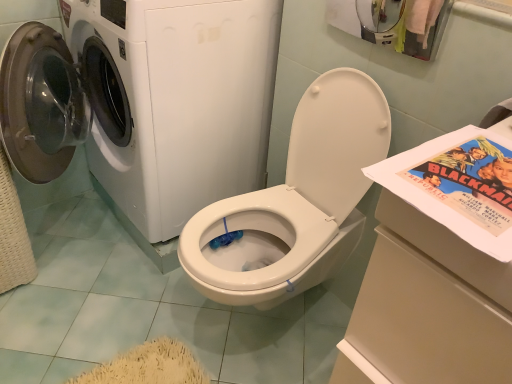
Describe the element at coordinates (297, 200) in the screenshot. The height and width of the screenshot is (384, 512). I see `white glossy washer at upper left` at that location.

The width and height of the screenshot is (512, 384). What do you see at coordinates (183, 103) in the screenshot? I see `white glossy washing machine at left` at bounding box center [183, 103].

Locate an element on the screen. white glossy washer at upper left is located at coordinates click(297, 200).

Considering the relative positions of matte paper comic book at right and white glossy washer at upper left in the image provided, is matte paper comic book at right to the right of white glossy washer at upper left from the viewer's perspective?

Yes, matte paper comic book at right is to the right of white glossy washer at upper left.

Does matte paper comic book at right have a lesser width compared to white glossy washer at upper left?

Yes, matte paper comic book at right is thinner than white glossy washer at upper left.

Considering the positions of objects matte paper comic book at right and white glossy washer at upper left in the image provided, who is behind, matte paper comic book at right or white glossy washer at upper left?

Positioned behind is white glossy washer at upper left.

Does matte paper comic book at right turn towards white glossy washer at upper left?

No, matte paper comic book at right is not turned towards white glossy washer at upper left.

From a real-world perspective, is white glossy washing machine at left above or below white glossy washer at upper left?

white glossy washing machine at left is situated higher than white glossy washer at upper left in the real world.

Does white glossy washing machine at left have a lesser height compared to white glossy washer at upper left?

No.

The width and height of the screenshot is (512, 384). I want to click on washer lying on the right of white glossy washing machine at left, so click(x=297, y=200).

Is the surface of white glossy washing machine at left in direct contact with white glossy washer at upper left?

No, white glossy washing machine at left is not in contact with white glossy washer at upper left.

From a real-world perspective, is matte paper comic book at right below white glossy washing machine at left?

Actually, matte paper comic book at right is physically above white glossy washing machine at left in the real world.

Can you confirm if matte paper comic book at right is taller than white glossy washing machine at left?

No, matte paper comic book at right is not taller than white glossy washing machine at left.

Considering the relative positions of matte paper comic book at right and white glossy washing machine at left in the image provided, is matte paper comic book at right in front of white glossy washing machine at left?

Yes, the depth of matte paper comic book at right is less than that of white glossy washing machine at left.

From the image's perspective, is matte paper comic book at right positioned above or below white glossy washing machine at left?

Clearly, from the image's perspective, matte paper comic book at right is below white glossy washing machine at left.

Is white glossy washer at upper left outside of matte paper comic book at right?

white glossy washer at upper left is positioned outside matte paper comic book at right.

Considering the positions of point (194, 224) and point (499, 194), is point (194, 224) closer or farther from the camera than point (499, 194)?

Point (194, 224) appears to be farther away from the viewer than point (499, 194).

Can you see white glossy washer at upper left touching matte paper comic book at right?

white glossy washer at upper left and matte paper comic book at right are clearly separated.

Between white glossy washing machine at left and matte paper comic book at right, which one is positioned in front?

matte paper comic book at right is closer to the camera.

Is white glossy washing machine at left oriented away from matte paper comic book at right?

No, white glossy washing machine at left is not facing the opposite direction of matte paper comic book at right.

Is point (233, 174) closer to viewer compared to point (495, 148)?

That is False.

Which of these two, white glossy washing machine at left or matte paper comic book at right, is smaller?

matte paper comic book at right is smaller.

Does white glossy washer at upper left have a greater height compared to white glossy washing machine at left?

In fact, white glossy washer at upper left may be shorter than white glossy washing machine at left.

From the image's perspective, is white glossy washer at upper left beneath white glossy washing machine at left?

Yes, from the image's perspective, white glossy washer at upper left is beneath white glossy washing machine at left.

From the picture: Is white glossy washing machine at left completely or partially inside white glossy washer at upper left?

No, white glossy washing machine at left is not a part of white glossy washer at upper left.

At what (x,y) coordinates should I click in order to perform the action: click on comic book on the right of white glossy washer at upper left. Please return your answer as a coordinate pair (x, y). This screenshot has width=512, height=384. Looking at the image, I should click on (471, 182).

Locate an element on the screen. washing machine above the white glossy washer at upper left (from the image's perspective) is located at coordinates (183, 103).

Looking at this image, looking at the image, which one is located further to white glossy washing machine at left, matte paper comic book at right or white glossy washer at upper left?

matte paper comic book at right is positioned further to the anchor white glossy washing machine at left.

In the scene shown: When comparing their distances from matte paper comic book at right, does white glossy washing machine at left or white glossy washer at upper left seem further?

white glossy washing machine at left.

Estimate the real-world distances between objects in this image. Which object is further from white glossy washer at upper left, matte paper comic book at right or white glossy washing machine at left?

matte paper comic book at right is positioned further to the anchor white glossy washer at upper left.

From the image, which object appears to be farther from white glossy washing machine at left, white glossy washer at upper left or matte paper comic book at right?

matte paper comic book at right.

Estimate the real-world distances between objects in this image. Which object is further from white glossy washer at upper left, white glossy washing machine at left or matte paper comic book at right?

Based on the image, matte paper comic book at right appears to be further to white glossy washer at upper left.

Estimate the real-world distances between objects in this image. Which object is further from matte paper comic book at right, white glossy washer at upper left or white glossy washing machine at left?

white glossy washing machine at left is positioned further to the anchor matte paper comic book at right.

Identify the location of washer between white glossy washing machine at left and matte paper comic book at right from left to right. (297, 200).